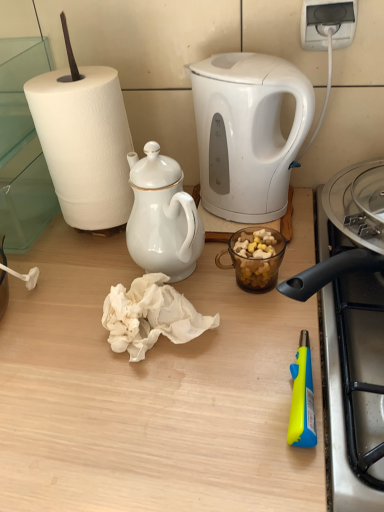
This screenshot has height=512, width=384. I want to click on vacant area that lies between translucent glass mug at center and white crumpled paper towel at center, so click(x=221, y=302).